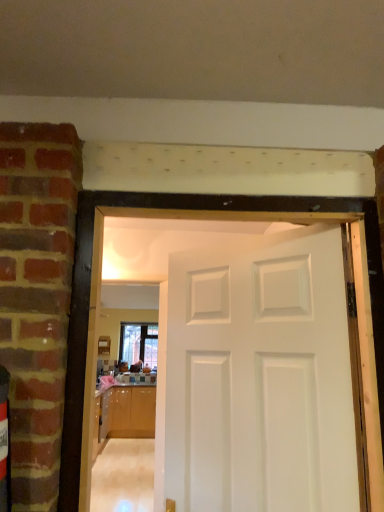
Question: Is clear glass window at center situated inside glossy wood cabinetry at lower left or outside?

Choices:
 (A) outside
 (B) inside

Answer: (A)

Question: Looking at the image, does clear glass window at center seem bigger or smaller compared to glossy wood cabinetry at lower left?

Choices:
 (A) big
 (B) small

Answer: (B)

Question: Estimate the real-world distances between objects in this image. Which object is closer to the white painted wood door at center?

Choices:
 (A) glossy wood cabinetry at lower left
 (B) clear glass window at center

Answer: (A)

Question: Which object is positioned farthest from the glossy wood cabinetry at lower left?

Choices:
 (A) clear glass window at center
 (B) white painted wood door at center

Answer: (B)